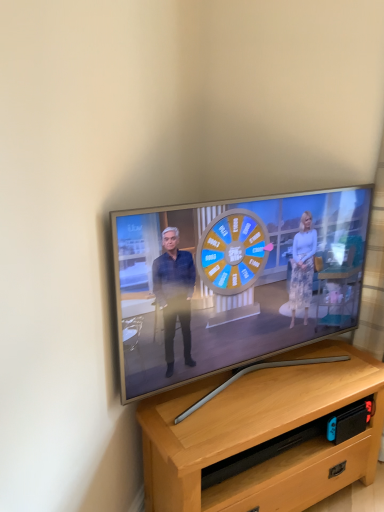
Where is `vacant area situated below matte silver tv at center (from a real-world perspective)`? This screenshot has height=512, width=384. vacant area situated below matte silver tv at center (from a real-world perspective) is located at coordinates (255, 372).